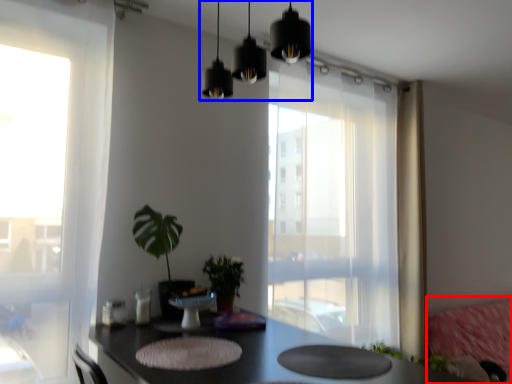
Question: Which of the following is the farthest to the observer, couch (highlighted by a red box) or lighting (highlighted by a blue box)?

Choices:
 (A) couch
 (B) lighting

Answer: (A)